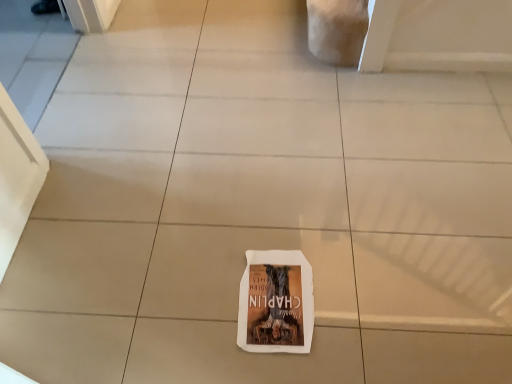
Find the location of a particular element. The width and height of the screenshot is (512, 384). free point behind white paper flyer at center is located at coordinates (270, 221).